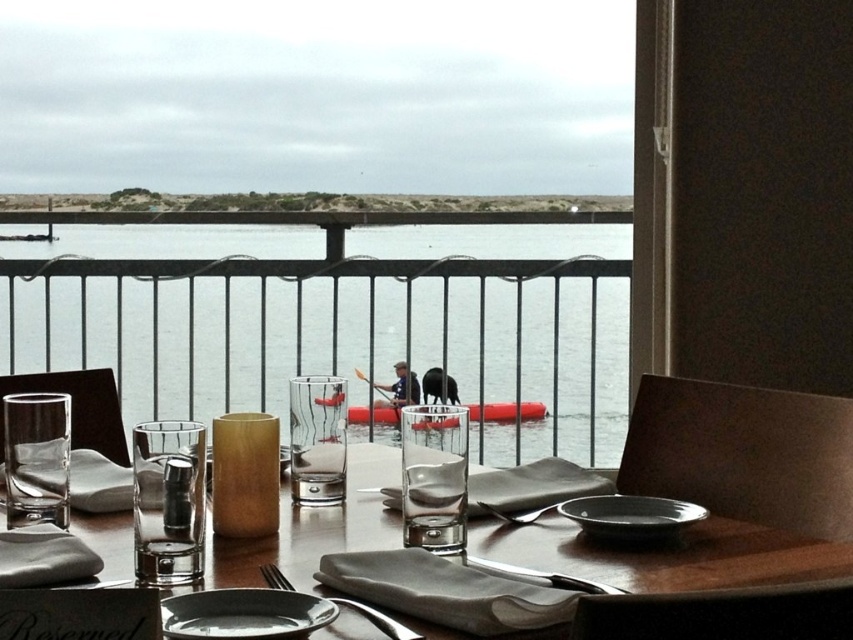
Which of these two, transparent water at center or matte glassware at center, stands shorter?

Standing shorter between the two is matte glassware at center.

Is point (202, 349) closer to viewer compared to point (761, 564)?

No, it is behind (761, 564).

Does point (494, 400) lie behind point (299, 563)?

Yes, point (494, 400) is farther from viewer.

The height and width of the screenshot is (640, 853). Identify the location of transparent water at center. (339, 320).

Is transparent water at center further to the viewer compared to satin silver fork at lower center?

That is True.

Is transparent water at center taller than satin silver fork at lower center?

Correct, transparent water at center is much taller as satin silver fork at lower center.

Who is more distant from viewer, (x=222, y=308) or (x=401, y=636)?

The point (x=222, y=308) is more distant.

Find the location of `transparent water at center`. transparent water at center is located at coordinates (339, 320).

Does matte glassware at center appear on the right side of matte black plate at center?

In fact, matte glassware at center is to the left of matte black plate at center.

Which of these two, matte glassware at center or matte black plate at center, stands shorter?

With less height is matte black plate at center.

The image size is (853, 640). I want to click on matte glassware at center, so click(668, 556).

I want to click on matte glassware at center, so click(668, 556).